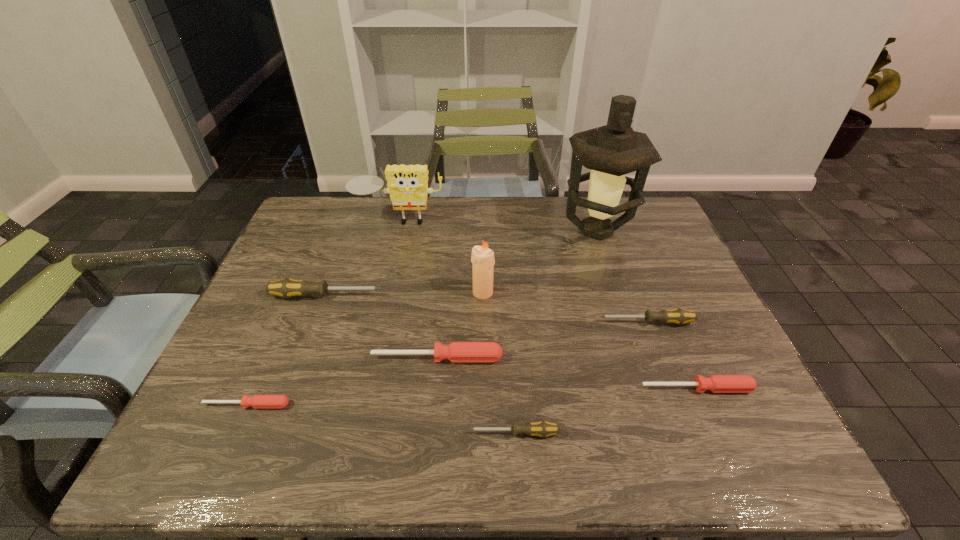
Choose which screwdriver is the fifth nearest neighbor to the oil lamp. Please provide its 2D coordinates. Your answer should be formatted as a tuple, i.e. [(x, y)], where the tuple contains the x and y coordinates of a point satisfying the conditions above.

[(543, 429)]

Locate an element on the screen. Image resolution: width=960 pixels, height=540 pixels. the second closest screwdriver to the candle is located at coordinates (287, 288).

Identify which gray screwdriver is located as the second nearest to the candle. Please provide its 2D coordinates. Your answer should be formatted as a tuple, i.e. [(x, y)], where the tuple contains the x and y coordinates of a point satisfying the conditions above.

[(678, 316)]

You are a GUI agent. You are given a task and a screenshot of the screen. Output one action in this format:
    pyautogui.click(x=<x>, y=<y>)
    Task: Click on the gray screwdriver that stands as the second closest to the nearest object
    
    Given the screenshot: What is the action you would take?
    pyautogui.click(x=287, y=288)

Identify which red screwdriver is the nearest to the second red screwdriver from left to right. Please provide its 2D coordinates. Your answer should be formatted as a tuple, i.e. [(x, y)], where the tuple contains the x and y coordinates of a point satisfying the conditions above.

[(258, 401)]

The image size is (960, 540). What are the coordinates of `red screwdriver that is the closest to the leftmost red screwdriver` in the screenshot? It's located at (456, 351).

Find the location of a particular element. free space that satisfies the following two spatial constraints: 1. at the tip of the farthest screwdriver; 2. on the left side of the biggest red screwdriver is located at coordinates (303, 358).

The image size is (960, 540). In order to click on free space that satisfies the following two spatial constraints: 1. at the tip of the rightmost gray screwdriver; 2. on the left side of the second nearest red screwdriver in this screenshot , I will do tap(671, 388).

Identify the location of blank space that satisfies the following two spatial constraints: 1. on the front-facing side of the farthest red screwdriver; 2. on the left side of the yellow sponge. The image size is (960, 540). (367, 358).